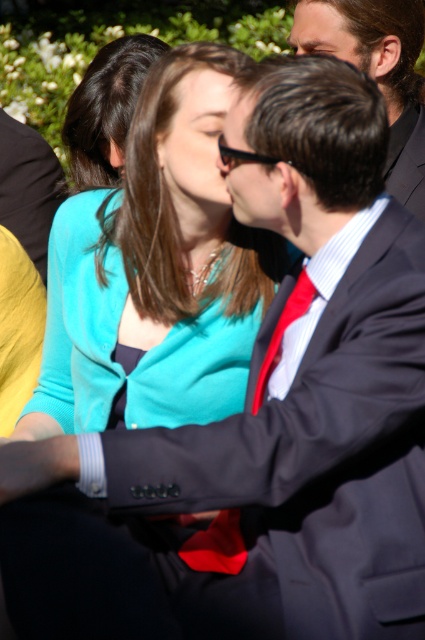
Question: Is matte black suit at center positioned at the back of red silk tie at center?

Choices:
 (A) no
 (B) yes

Answer: (B)

Question: Can you confirm if matte black suit at center is positioned to the right of red silk tie at center?

Choices:
 (A) yes
 (B) no

Answer: (B)

Question: Which of the following is the farthest from the observer?

Choices:
 (A) red silk tie at center
 (B) matte black suit at center

Answer: (B)

Question: Which point is closer to the camera?

Choices:
 (A) [297, 284]
 (B) [53, 160]

Answer: (A)

Question: Is matte black suit at center to the right of red silk tie at center from the viewer's perspective?

Choices:
 (A) yes
 (B) no

Answer: (B)

Question: Among these points, which one is nearest to the camera?

Choices:
 (A) (263, 387)
 (B) (31, 186)

Answer: (A)